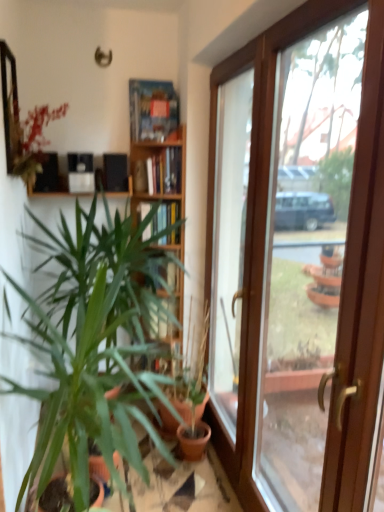
Describe the element at coordinates (10, 106) in the screenshot. Image resolution: width=384 pixels, height=512 pixels. I see `matte black mirror at upper left` at that location.

What is the approximate width of matte black shelf at upper left?

It is 20.29 centimeters.

Image resolution: width=384 pixels, height=512 pixels. Describe the element at coordinates (50, 192) in the screenshot. I see `matte black shelf at upper left` at that location.

The height and width of the screenshot is (512, 384). I want to click on clear glass door at center, so click(230, 239).

What is the approximate width of hardcover book at center, the second book positioned from the top?

8.53 inches.

The width and height of the screenshot is (384, 512). Describe the element at coordinates (162, 219) in the screenshot. I see `hardcover book at center, the second book positioned from the top` at that location.

Image resolution: width=384 pixels, height=512 pixels. What do you see at coordinates (158, 160) in the screenshot? I see `wooden bookshelf at center` at bounding box center [158, 160].

Locate an element on the screen. Image resolution: width=384 pixels, height=512 pixels. matte black mirror at upper left is located at coordinates (10, 106).

How far apart are green matte plant at left, which ranks as the 2th houseplant in right-to-left order, and wooden bookshelf at center?

green matte plant at left, which ranks as the 2th houseplant in right-to-left order, and wooden bookshelf at center are 21.87 inches apart.

Between green matte plant at left, which ranks as the 2th houseplant in right-to-left order, and wooden bookshelf at center, which one is positioned behind?

wooden bookshelf at center is more distant.

From the image's perspective, is green matte plant at left, positioned as the 1th houseplant in left-to-right order, above or below wooden bookshelf at center?

Clearly, from the image's perspective, green matte plant at left, positioned as the 1th houseplant in left-to-right order, is below wooden bookshelf at center.

Between green matte plant at left, positioned as the 1th houseplant in left-to-right order, and wooden bookshelf at center, which one has smaller width?

With smaller width is wooden bookshelf at center.

Would you say hardcover books at upper center, the first book in the top-to-bottom sequence, is inside or outside clear glass door at center?

hardcover books at upper center, the first book in the top-to-bottom sequence, is spatially situated outside clear glass door at center.

Based on the photo, is hardcover books at upper center, the first book in the top-to-bottom sequence, oriented away from clear glass door at center?

No, hardcover books at upper center, the first book in the top-to-bottom sequence,'s orientation is not away from clear glass door at center.

Is clear glass door at center spatially inside brown wooden door at right, or outside of it?

The correct answer is: outside.

You are a GUI agent. You are given a task and a screenshot of the screen. Output one action in this format:
    pyautogui.click(x=<x>, y=<y>)
    Task: Click on the window located above the brown wooden door at right (from the image's perspective)
    The height and width of the screenshot is (512, 384).
    Given the screenshot: What is the action you would take?
    pyautogui.click(x=230, y=239)

From the image's perspective, which one is positioned higher, clear glass door at center or brown wooden door at right?

clear glass door at center.

Which is in front, point (236, 101) or point (332, 470)?

The point (332, 470) is more forward.

Does green matte plant at center, the 2th houseplant from the left, come behind wooden bookshelf at center?

No.

Does green matte plant at center, arranged as the 1th houseplant when viewed from the right, have a lesser width compared to wooden bookshelf at center?

No, green matte plant at center, arranged as the 1th houseplant when viewed from the right, is not thinner than wooden bookshelf at center.

From a real-world perspective, is green matte plant at center, arranged as the 1th houseplant when viewed from the right, on wooden bookshelf at center?

No, from a real-world perspective, green matte plant at center, arranged as the 1th houseplant when viewed from the right, is not over wooden bookshelf at center

Between green matte plant at center, arranged as the 1th houseplant when viewed from the right, and wooden bookshelf at center, which one appears on the left side from the viewer's perspective?

wooden bookshelf at center is more to the left.

Can you tell me how much green matte plant at left, which ranks as the 2th houseplant in right-to-left order, and hardcover book at center, which is the first book in bottom-to-top order, differ in facing direction?

The angle between the facing direction of green matte plant at left, which ranks as the 2th houseplant in right-to-left order, and the facing direction of hardcover book at center, which is the first book in bottom-to-top order, is 2.53 degrees.

From a real-world perspective, which object stands above the other?

In real-world perspective, hardcover book at center, the second book positioned from the top, is above.

Identify the location of the 2nd houseplant in front of the hardcover book at center, which is the first book in bottom-to-top order. (93, 341).

Is hardcover books at upper center, the first book in the top-to-bottom sequence, aimed at green matte plant at left, which ranks as the 2th houseplant in right-to-left order?

No, hardcover books at upper center, the first book in the top-to-bottom sequence, is not facing towards green matte plant at left, which ranks as the 2th houseplant in right-to-left order.

Considering the positions of objects hardcover books at upper center, the first book in the top-to-bottom sequence, and green matte plant at left, positioned as the 1th houseplant in left-to-right order, in the image provided, who is more to the left, hardcover books at upper center, the first book in the top-to-bottom sequence, or green matte plant at left, positioned as the 1th houseplant in left-to-right order,?

green matte plant at left, positioned as the 1th houseplant in left-to-right order, is more to the left.

Which object is further away from the camera taking this photo, hardcover books at upper center, marked as the second book in a bottom-to-top arrangement, or green matte plant at left, which ranks as the 2th houseplant in right-to-left order?

hardcover books at upper center, marked as the second book in a bottom-to-top arrangement, is further from the camera.

Choose the correct answer: Is hardcover books at upper center, the first book in the top-to-bottom sequence, inside green matte plant at left, positioned as the 1th houseplant in left-to-right order, or outside it?

hardcover books at upper center, the first book in the top-to-bottom sequence, is not inside green matte plant at left, positioned as the 1th houseplant in left-to-right order, it's outside.

The height and width of the screenshot is (512, 384). In order to click on bookcase in front of the hardcover books at upper center, the first book in the top-to-bottom sequence in this screenshot , I will do `click(158, 160)`.

From the image's perspective, is hardcover books at upper center, the first book in the top-to-bottom sequence, on wooden bookshelf at center?

Yes.

Is hardcover books at upper center, marked as the second book in a bottom-to-top arrangement, facing away from wooden bookshelf at center?

Yes, wooden bookshelf at center is at the back of hardcover books at upper center, marked as the second book in a bottom-to-top arrangement.

Does hardcover books at upper center, marked as the second book in a bottom-to-top arrangement, come behind wooden bookshelf at center?

Yes, hardcover books at upper center, marked as the second book in a bottom-to-top arrangement, is further from the camera.

The height and width of the screenshot is (512, 384). I want to click on the 2nd houseplant in front of the wooden bookshelf at center, so click(x=93, y=341).

Find the location of a particular element. Image resolution: width=384 pixels, height=512 pixels. the 1st book behind the clear glass door at center is located at coordinates (162, 172).

Considering their positions, is brown wooden door at right positioned closer to matte black shelf at upper left than wooden bookshelf at center?

Based on the image, wooden bookshelf at center appears to be nearer to matte black shelf at upper left.

Which object lies nearer to the anchor point clear glass door at center, green matte plant at left, which ranks as the 2th houseplant in right-to-left order, or hardcover books at upper center, marked as the second book in a bottom-to-top arrangement?

hardcover books at upper center, marked as the second book in a bottom-to-top arrangement, is positioned closer to the anchor clear glass door at center.

Consider the image. Looking at the image, which one is located closer to brown wooden door at right, wooden bookshelf at center or hardcover books at upper center, marked as the second book in a bottom-to-top arrangement?

Among the two, wooden bookshelf at center is located nearer to brown wooden door at right.

Considering their positions, is clear glass door at center positioned closer to green matte plant at left, which ranks as the 2th houseplant in right-to-left order, than green matte plant at center, the 2th houseplant from the left?

Based on the image, green matte plant at center, the 2th houseplant from the left, appears to be nearer to green matte plant at left, which ranks as the 2th houseplant in right-to-left order.

When comparing their distances from matte black mirror at upper left, does clear glass door at center or green matte plant at center, the 2th houseplant from the left, seem further?

green matte plant at center, the 2th houseplant from the left, is further to matte black mirror at upper left.

Looking at the image, which one is located closer to green matte plant at center, arranged as the 1th houseplant when viewed from the right, hardcover books at upper center, the first book in the top-to-bottom sequence, or matte black mirror at upper left?

The object closer to green matte plant at center, arranged as the 1th houseplant when viewed from the right, is hardcover books at upper center, the first book in the top-to-bottom sequence.

Based on their spatial positions, is green matte plant at left, positioned as the 1th houseplant in left-to-right order, or clear glass door at center further from wooden bookshelf at center?

The object further to wooden bookshelf at center is green matte plant at left, positioned as the 1th houseplant in left-to-right order.

Looking at the image, which one is located further to hardcover book at center, the second book positioned from the top, brown wooden door at right or wooden bookshelf at center?

The object further to hardcover book at center, the second book positioned from the top, is brown wooden door at right.

Find the location of a particular element. Image resolution: width=384 pixels, height=512 pixels. bookcase positioned between matte black mirror at upper left and hardcover books at upper center, the first book in the top-to-bottom sequence, from near to far is located at coordinates (158, 160).

Locate an element on the screen. The image size is (384, 512). window between matte black shelf at upper left and green matte plant at center, arranged as the 1th houseplant when viewed from the right, vertically is located at coordinates (230, 239).

Where is `bookcase that lies between matte black shelf at upper left and green matte plant at center, the 2th houseplant from the left, from top to bottom`? This screenshot has height=512, width=384. bookcase that lies between matte black shelf at upper left and green matte plant at center, the 2th houseplant from the left, from top to bottom is located at coordinates (158, 160).

Where is `bookcase between matte black mirror at upper left and matte black shelf at upper left from front to back`? The height and width of the screenshot is (512, 384). bookcase between matte black mirror at upper left and matte black shelf at upper left from front to back is located at coordinates (158, 160).